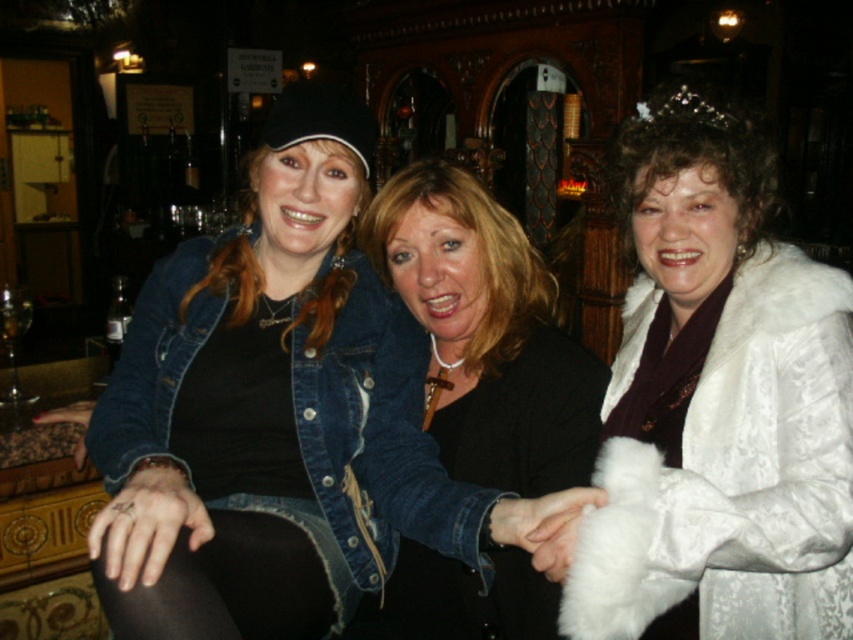
Does denim jacket at center have a smaller size compared to black tights at lower left?

Incorrect, denim jacket at center is not smaller in size than black tights at lower left.

Is the position of denim jacket at center less distant than that of black tights at lower left?

That is False.

Does point (479, 566) come behind point (144, 605)?

That is True.

This screenshot has height=640, width=853. What are the coordinates of `denim jacket at center` in the screenshot? It's located at (276, 416).

Is black matte jacket at center positioned behind black tights at lower left?

Yes, it is behind black tights at lower left.

The image size is (853, 640). Describe the element at coordinates (483, 333) in the screenshot. I see `black matte jacket at center` at that location.

Where is `black matte jacket at center`? black matte jacket at center is located at coordinates (483, 333).

Looking at this image, does white fur coat at center have a greater height compared to black tights at lower left?

Correct, white fur coat at center is much taller as black tights at lower left.

Find the location of `white fur coat at center`. white fur coat at center is located at coordinates (723, 400).